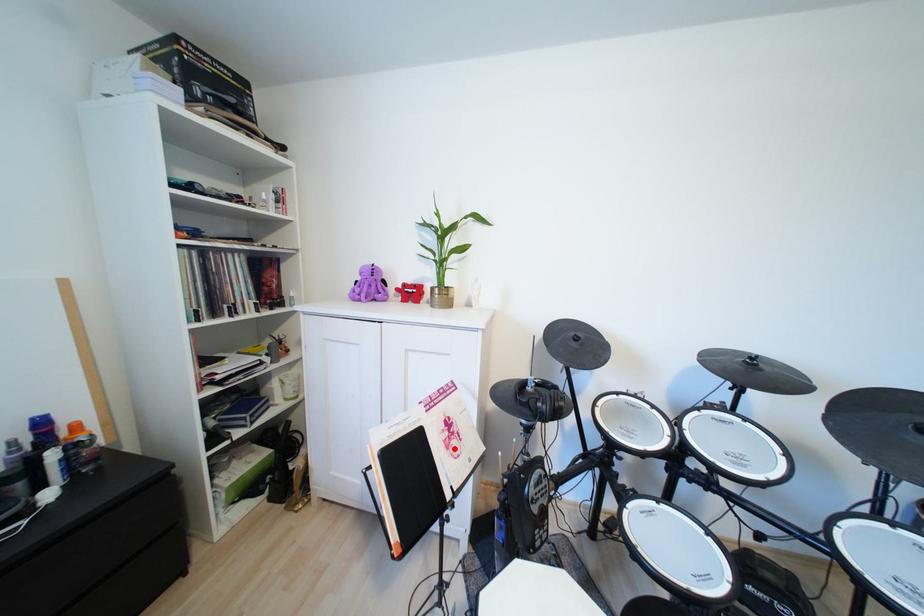
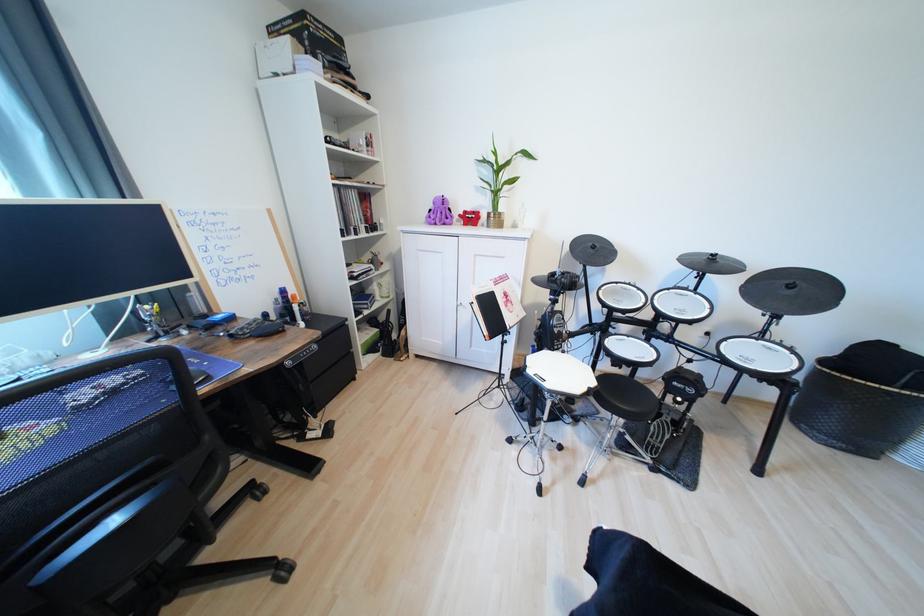
Where in the second image is the point corresponding to the highlighted location from the first image?

(513, 307)